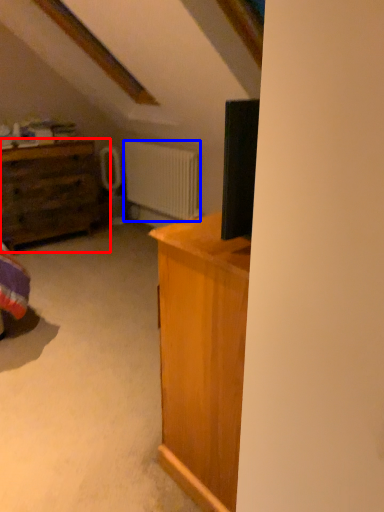
Question: Among these objects, which one is farthest to the camera, chest of drawers (highlighted by a red box) or radiator (highlighted by a blue box)?

Choices:
 (A) chest of drawers
 (B) radiator

Answer: (B)